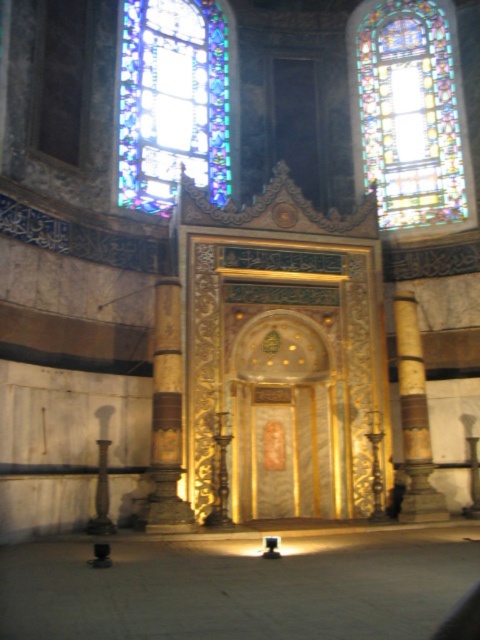
Question: Can you confirm if gold-carved column at center is positioned below gold polished column at right?

Choices:
 (A) no
 (B) yes

Answer: (B)

Question: Is stained glass window at upper left bigger than gold polished column at right?

Choices:
 (A) yes
 (B) no

Answer: (A)

Question: Which point appears farthest from the camera in this image?

Choices:
 (A) (421, 371)
 (B) (171, 518)
 (C) (166, 83)

Answer: (C)

Question: Which point is closer to the camera taking this photo?

Choices:
 (A) (408, 317)
 (B) (430, 100)
 (C) (151, 132)
 (D) (162, 419)

Answer: (D)

Question: Does stained glass at upper right have a larger size compared to gold polished column at right?

Choices:
 (A) no
 (B) yes

Answer: (B)

Question: Which point is closer to the camera?

Choices:
 (A) stained glass at upper right
 (B) gold-carved column at center
 (C) gold polished column at right
 (D) stained glass window at upper left

Answer: (B)